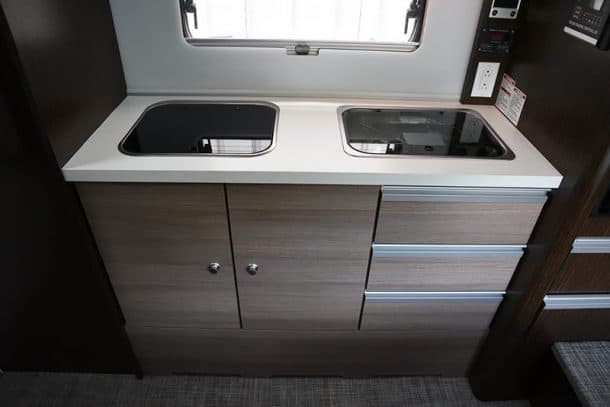
What are the coordinates of `left drawer` in the screenshot? It's located at (154, 241).